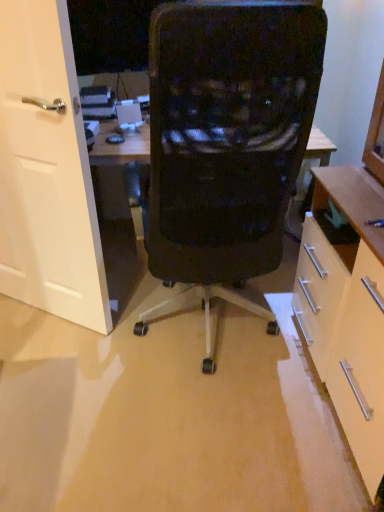
Locate an element on the screen. The height and width of the screenshot is (512, 384). spots to the right of white matte door at left is located at coordinates 136,337.